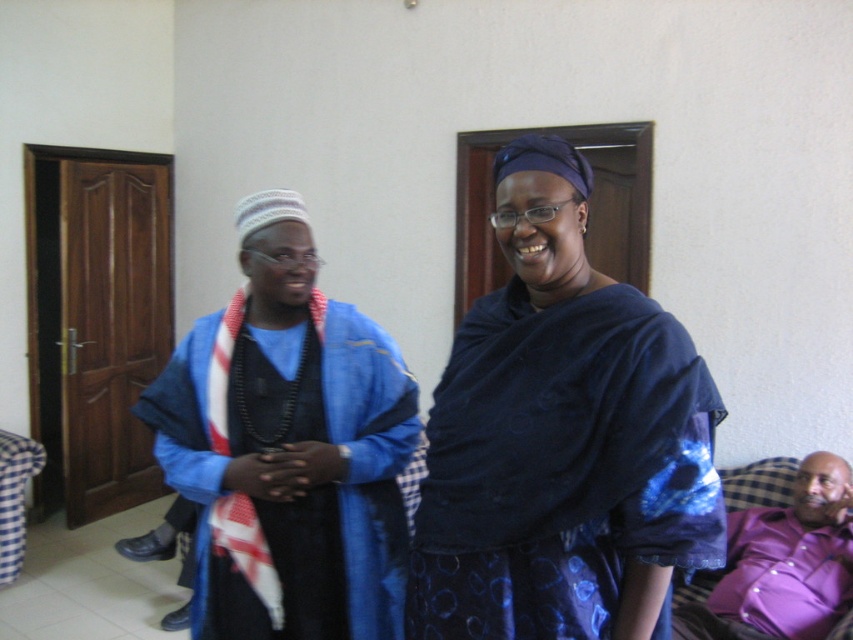
Image resolution: width=853 pixels, height=640 pixels. In order to click on blue satin dress at center in this screenshot , I will do `click(561, 438)`.

Which of these two, blue satin dress at center or blue textured robe at center, stands taller?

blue satin dress at center is taller.

Is point (616, 397) positioned in front of point (181, 369)?

Yes, it is in front of point (181, 369).

At what (x,y) coordinates should I click in order to perform the action: click on blue satin dress at center. Please return your answer as a coordinate pair (x, y). The image size is (853, 640). Looking at the image, I should click on (561, 438).

From the picture: Can you confirm if blue satin dress at center is shorter than purple satin shirt at lower right?

Incorrect, blue satin dress at center's height does not fall short of purple satin shirt at lower right's.

Is blue satin dress at center below purple satin shirt at lower right?

Actually, blue satin dress at center is above purple satin shirt at lower right.

The width and height of the screenshot is (853, 640). Find the location of `blue satin dress at center`. blue satin dress at center is located at coordinates (561, 438).

Measure the distance from blue textured robe at center to purple satin shirt at lower right.

A distance of 1.19 meters exists between blue textured robe at center and purple satin shirt at lower right.

Between point (357, 321) and point (830, 552), which one is positioned behind?

The point (830, 552) is behind.

Between point (207, 529) and point (757, 636), which one is positioned in front?

Point (207, 529) is more forward.

Locate an element on the screen. This screenshot has height=640, width=853. blue textured robe at center is located at coordinates (369, 460).